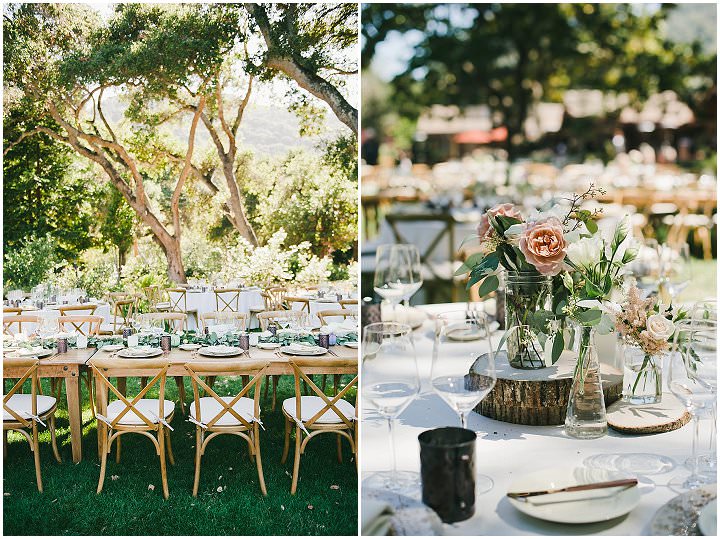
Locate an element on the screen. The image size is (720, 539). empty space on table is located at coordinates (523, 457).